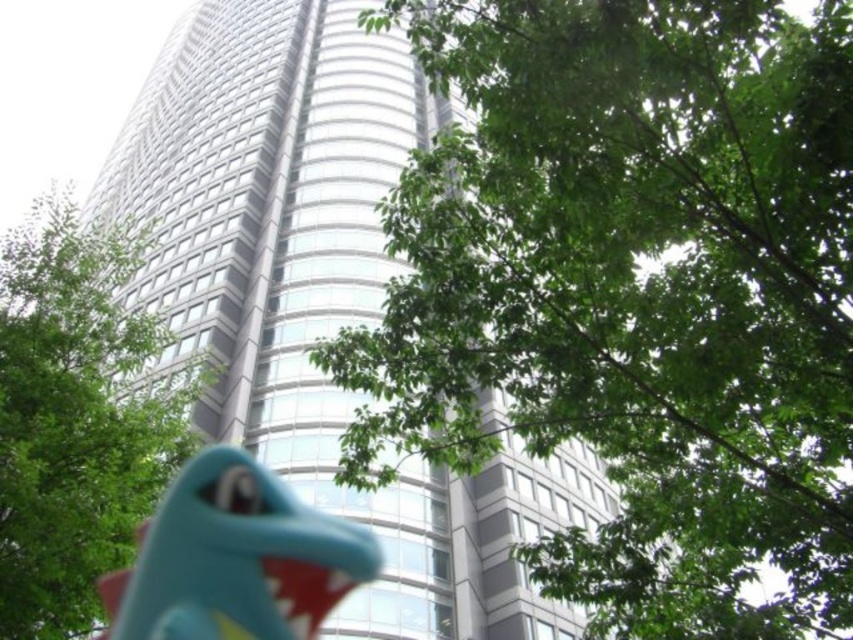
Question: Which point is closer to the camera?

Choices:
 (A) (469, 275)
 (B) (64, 554)
 (C) (218, 36)
 (D) (244, 616)

Answer: (A)

Question: Which of the following is the farthest from the observer?

Choices:
 (A) green leafy tree at lower left
 (B) teal rubber dinosaur at lower center
 (C) green leafy tree at center
 (D) glassy silver tower at center

Answer: (D)

Question: Is green leafy tree at center above green leafy tree at lower left?

Choices:
 (A) yes
 (B) no

Answer: (A)

Question: Considering the real-world distances, which object is farthest from the teal rubber dinosaur at lower center?

Choices:
 (A) glassy silver tower at center
 (B) green leafy tree at lower left

Answer: (A)

Question: Is green leafy tree at center behind teal rubber dinosaur at lower center?

Choices:
 (A) no
 (B) yes

Answer: (A)

Question: Can you confirm if green leafy tree at center is positioned above glassy silver tower at center?

Choices:
 (A) yes
 (B) no

Answer: (B)